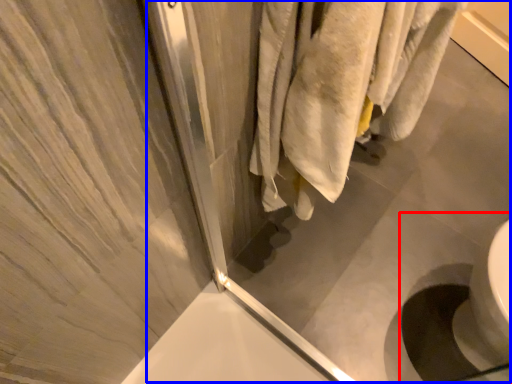
Question: Among these objects, which one is farthest to the camera, sink (highlighted by a red box) or screen door (highlighted by a blue box)?

Choices:
 (A) sink
 (B) screen door

Answer: (A)